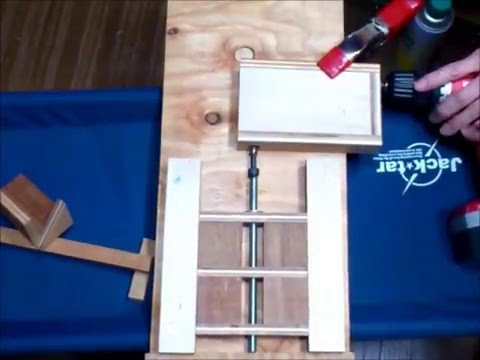
Locate an element on the screen. The image size is (480, 360). blue sheet is located at coordinates (11, 290).